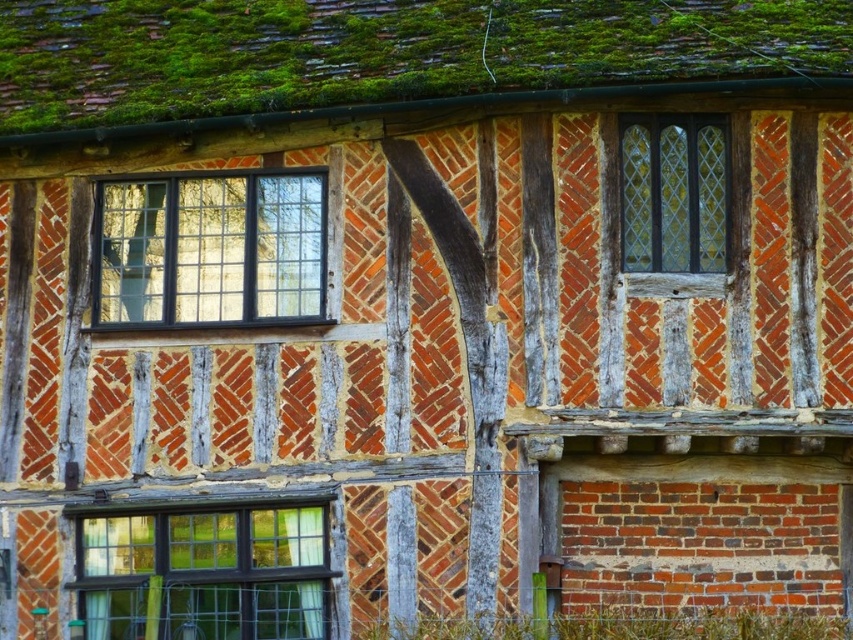
Between black glass window at upper left and matte black window at lower left, which one has more height?

black glass window at upper left is taller.

Is point (177, 269) behind point (202, 620)?

Yes, point (177, 269) is farther from viewer.

Measure the distance between point (206, 272) and camera.

Point (206, 272) is 19.24 meters from camera.

The width and height of the screenshot is (853, 640). I want to click on black glass window at upper left, so click(212, 250).

Does point (787, 42) come in front of point (152, 536)?

No, it is not.

Where is `green mossy tiles at upper center`? The width and height of the screenshot is (853, 640). green mossy tiles at upper center is located at coordinates (381, 54).

This screenshot has height=640, width=853. Identify the location of green mossy tiles at upper center. (381, 54).

From the picture: Is black glass window at upper left thinner than clear glass window at upper right?

Incorrect, black glass window at upper left's width is not less than clear glass window at upper right's.

Is black glass window at upper left behind clear glass window at upper right?

Yes, it is behind clear glass window at upper right.

What do you see at coordinates (212, 250) in the screenshot?
I see `black glass window at upper left` at bounding box center [212, 250].

Where is `black glass window at upper left`? Image resolution: width=853 pixels, height=640 pixels. black glass window at upper left is located at coordinates (212, 250).